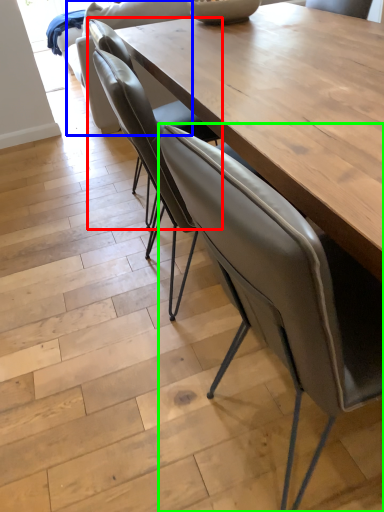
Question: Which object is positioned closest to chair (highlighted by a red box)? Select from armchair (highlighted by a blue box) and chair (highlighted by a green box).

Choices:
 (A) armchair
 (B) chair

Answer: (B)